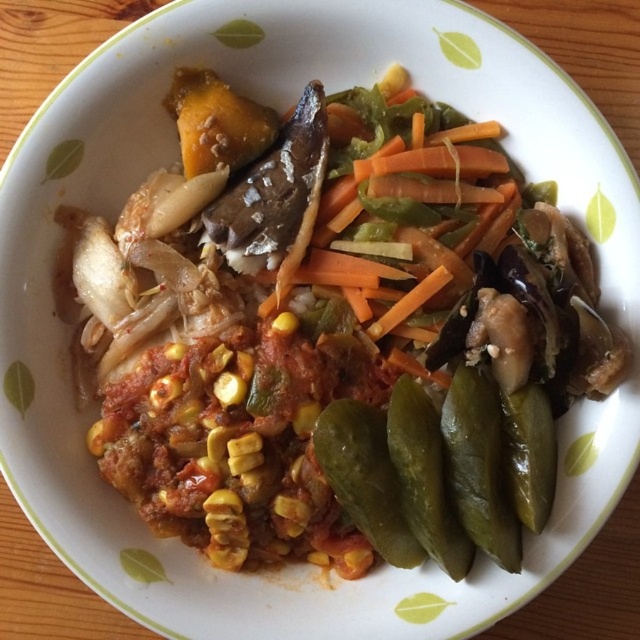
Question: Is green glossy pickles at lower right to the left of green glossy pickles at bottom right from the viewer's perspective?

Choices:
 (A) no
 (B) yes

Answer: (A)

Question: Estimate the real-world distances between objects in this image. Which object is closer to the green glossy pickles at lower right?

Choices:
 (A) green pickled vegetable at center
 (B) green glossy pickles at bottom right

Answer: (B)

Question: Can you confirm if green pickled vegetable at center is positioned to the right of green glossy pickles at bottom right?

Choices:
 (A) yes
 (B) no

Answer: (B)

Question: Considering the relative positions of green glossy pickles at lower right and green glossy pickles at bottom right in the image provided, where is green glossy pickles at lower right located with respect to green glossy pickles at bottom right?

Choices:
 (A) left
 (B) right

Answer: (B)

Question: Which object appears closest to the camera in this image?

Choices:
 (A) green glossy pickles at bottom right
 (B) green glossy pickles at lower right
 (C) green pickled vegetable at center

Answer: (B)

Question: Which object appears farthest from the camera in this image?

Choices:
 (A) green glossy pickles at lower right
 (B) green pickled vegetable at center

Answer: (B)